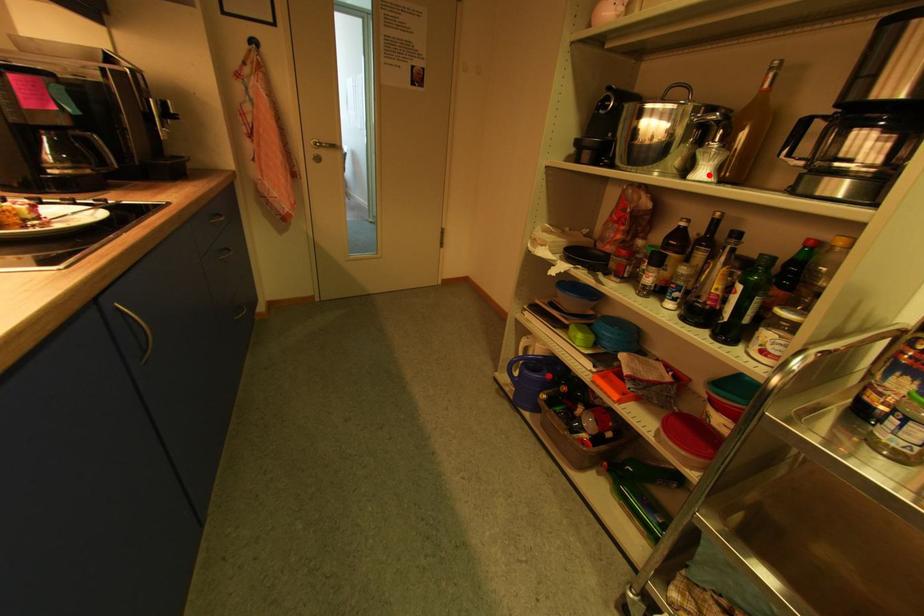
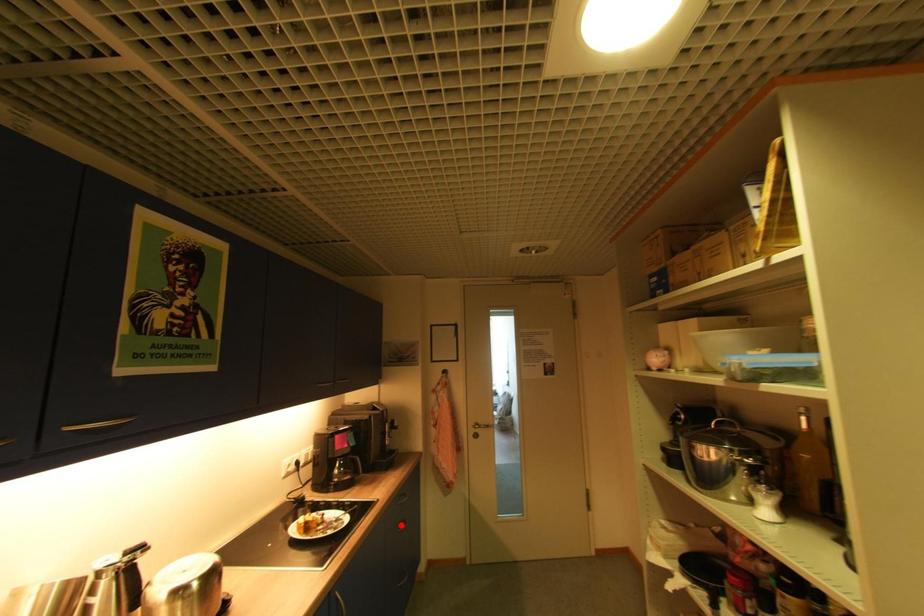
Consider the image. I am providing you with two images of the same scene from different viewpoints. A red point is marked on the first image and another point is marked on the second image. Is the red point in image1 aligned with the point shown in image2?

No